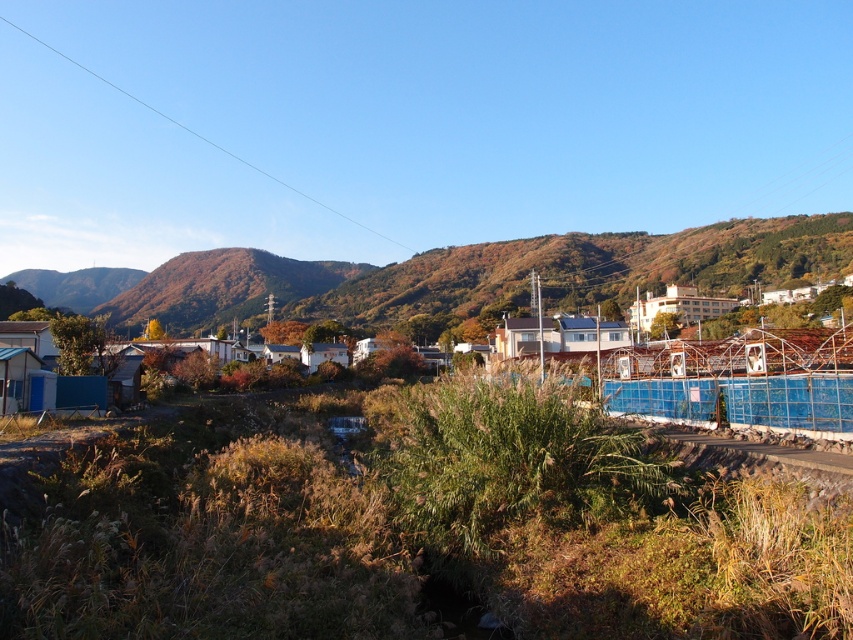
Does blue plastic amusement park at center lie in front of white matte building at lower left?

Yes, blue plastic amusement park at center is closer to the viewer.

Between blue plastic amusement park at center and white matte building at lower left, which one has less height?

Standing shorter between the two is blue plastic amusement park at center.

Where is `blue plastic amusement park at center`? This screenshot has height=640, width=853. blue plastic amusement park at center is located at coordinates (415, 525).